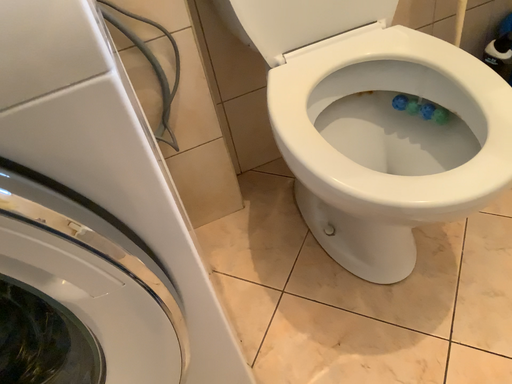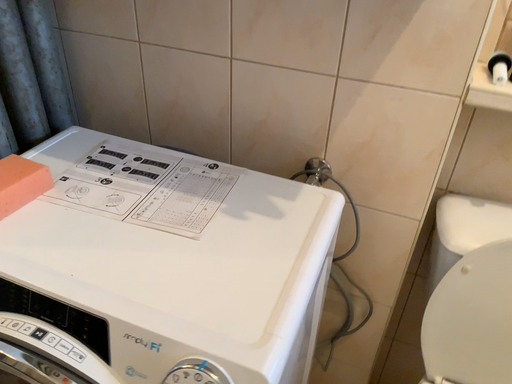
Question: Which way did the camera rotate in the video?

Choices:
 (A) rotated right
 (B) rotated left

Answer: (B)